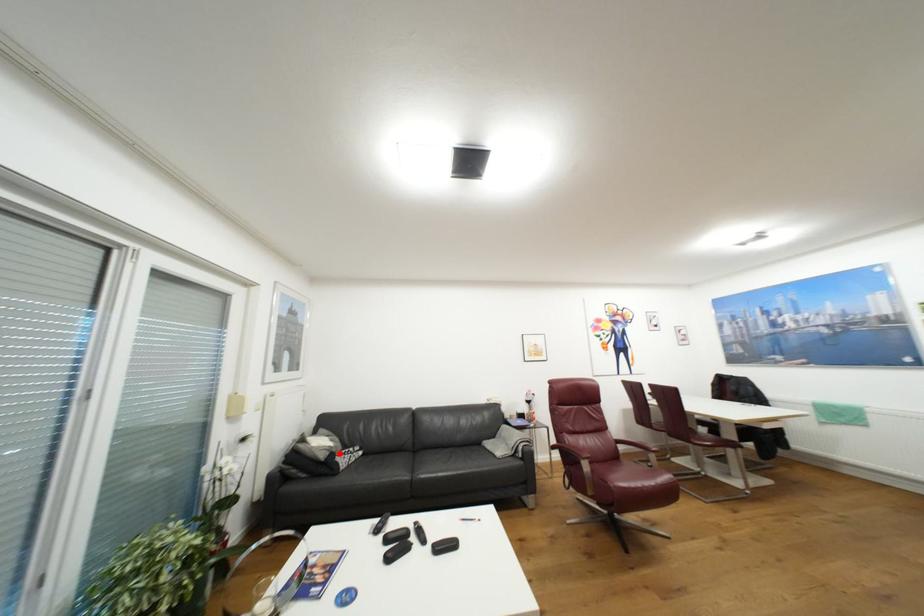
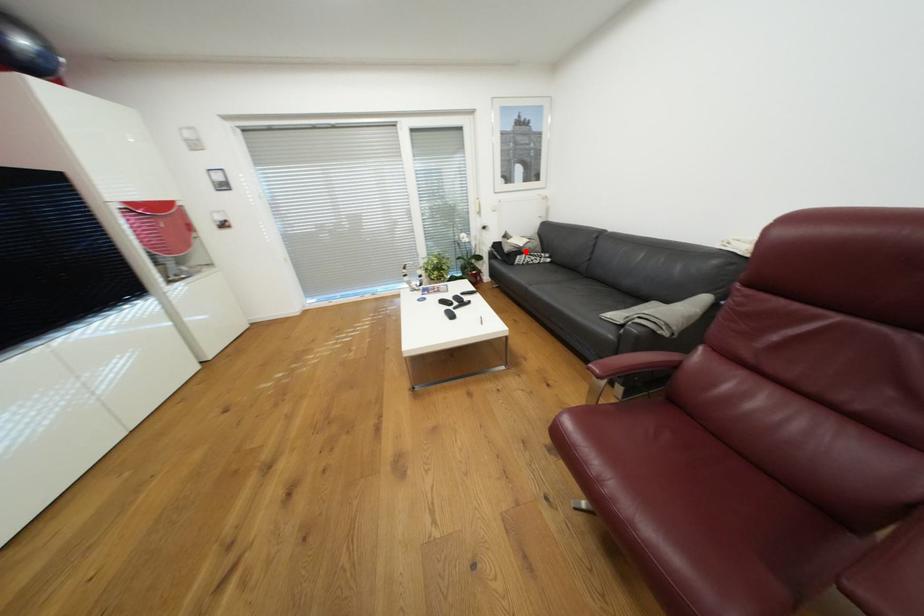
I am providing you with two images of the same scene from different viewpoints. A red point is marked on the first image and another point is marked on the second image. Does the point marked in image1 correspond to the same location as the one in image2?

Yes